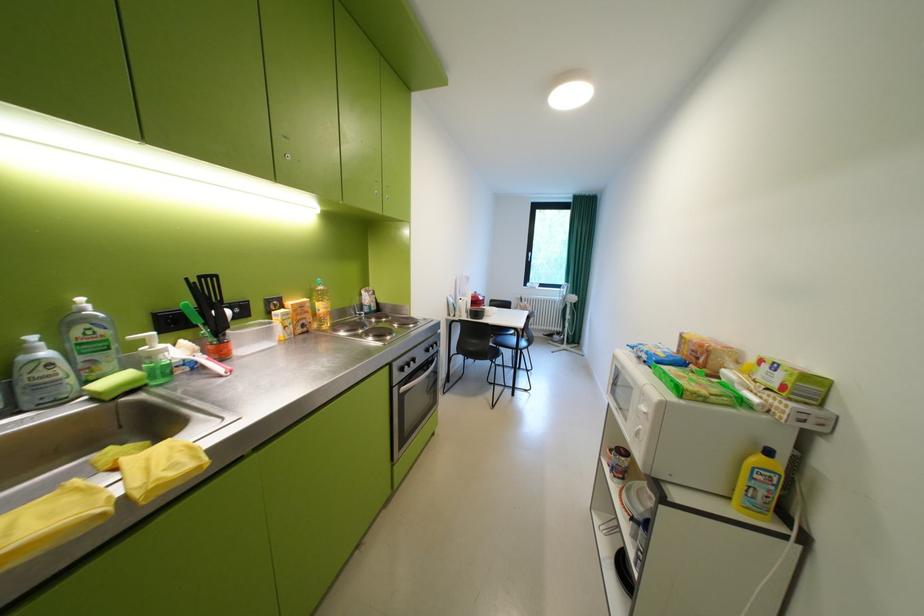
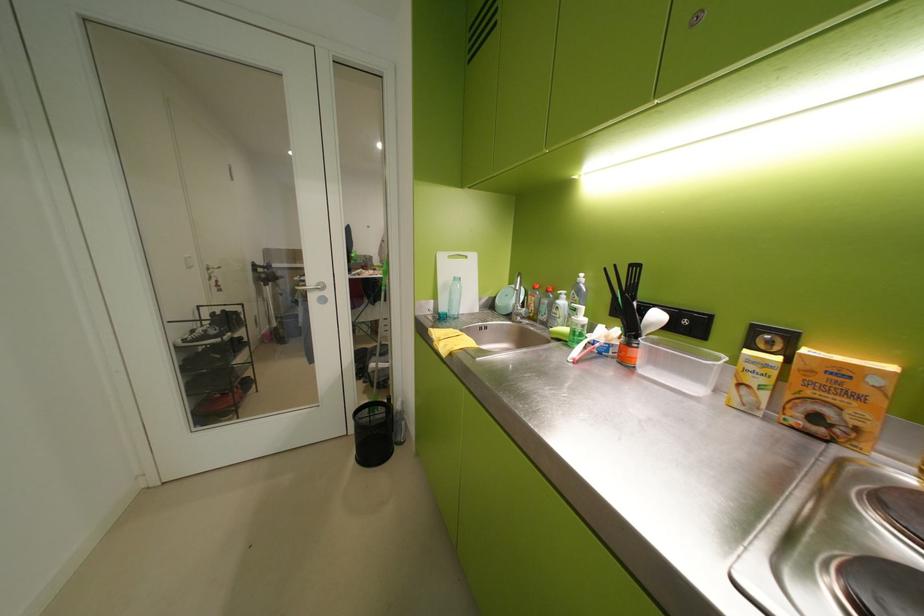
Where in the second image is the point corresponding to (311,306) from the first image?

(852, 373)